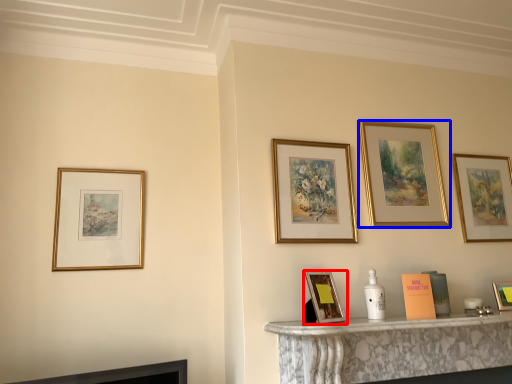
Question: Which point is further to the camera, picture frame (highlighted by a red box) or picture frame (highlighted by a blue box)?

Choices:
 (A) picture frame
 (B) picture frame

Answer: (B)